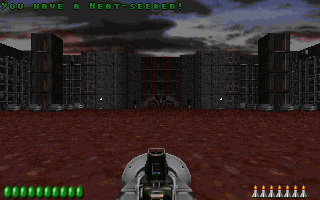
At what (x,y) coordinates should I click in order to perform the action: click on candles. Please return your answer as a coordinate pair (x, y). This screenshot has width=320, height=200. Looking at the image, I should click on (261, 194).